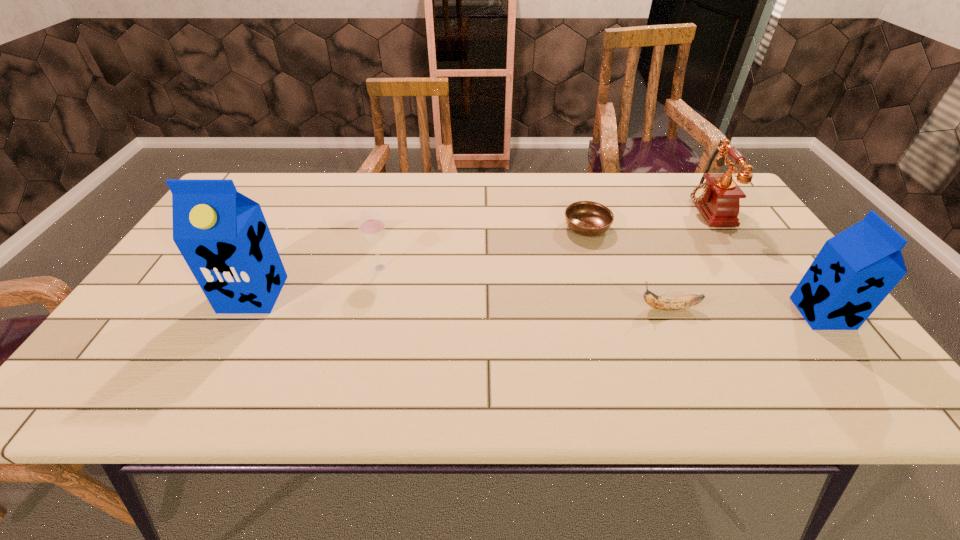
Find the location of a particular element. the left carton is located at coordinates (x=223, y=236).

What are the coordinates of `the taller carton` in the screenshot? It's located at (223, 236).

Find the location of a particular element. The image size is (960, 540). the fifth shortest object is located at coordinates (855, 270).

Find the location of a particular element. The height and width of the screenshot is (540, 960). the shorter carton is located at coordinates (855, 270).

The height and width of the screenshot is (540, 960). Find the location of `the shortest object`. the shortest object is located at coordinates (587, 218).

The image size is (960, 540). In order to click on the fifth object from left to right in this screenshot , I will do `click(718, 199)`.

In order to click on the third tallest object in this screenshot , I will do `click(718, 199)`.

Locate an element on the screen. The width and height of the screenshot is (960, 540). the second shortest object is located at coordinates (659, 302).

At what (x,y) coordinates should I click in order to perform the action: click on the fifth object from right to left. Please return your answer as a coordinate pair (x, y). This screenshot has width=960, height=540. Looking at the image, I should click on (371, 225).

The height and width of the screenshot is (540, 960). Find the location of `the third shortest object`. the third shortest object is located at coordinates (371, 225).